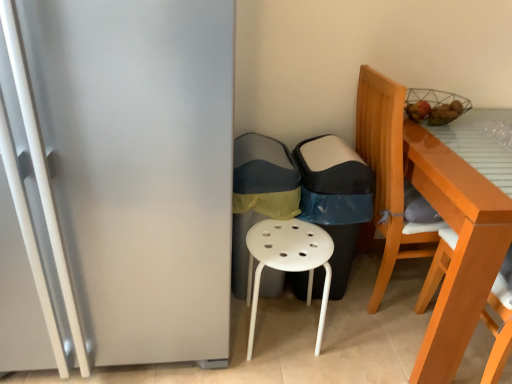
You are a GUI agent. You are given a task and a screenshot of the screen. Output one action in this format:
    pyautogui.click(x=<x>, y=<y>)
    Task: Click on the vacant area on top of white plastic stool at center (from a real-world perspective)
    The height and width of the screenshot is (384, 512).
    Given the screenshot: What is the action you would take?
    pyautogui.click(x=288, y=239)